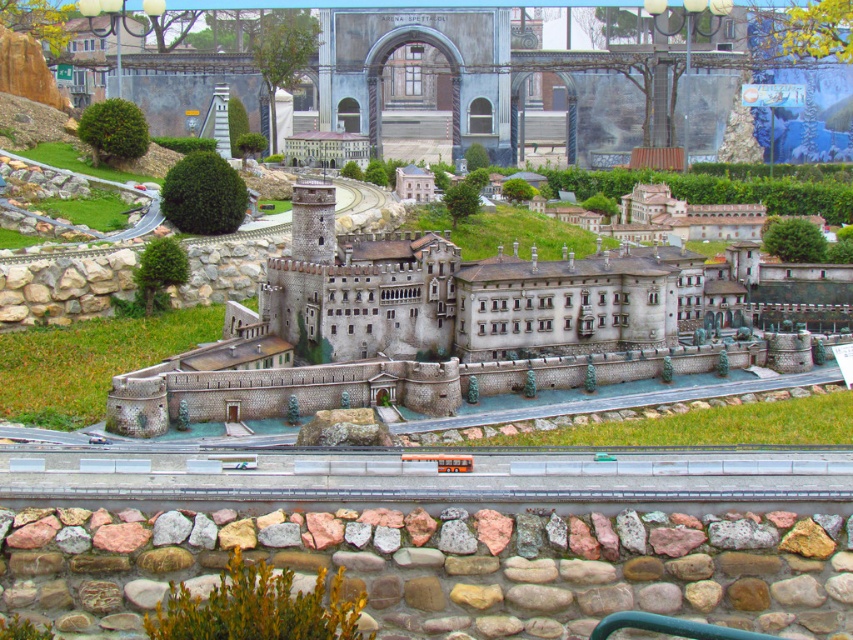
Question: Does stone castle at center lie behind smooth gray train track at center?

Choices:
 (A) no
 (B) yes

Answer: (B)

Question: Is stone castle at center positioned in front of smooth gray train track at center?

Choices:
 (A) no
 (B) yes

Answer: (A)

Question: Considering the relative positions of stone castle at center and smooth gray train track at center in the image provided, where is stone castle at center located with respect to smooth gray train track at center?

Choices:
 (A) right
 (B) left

Answer: (B)

Question: Among these points, which one is farthest from the camera?

Choices:
 (A) (368, 364)
 (B) (666, 502)

Answer: (A)

Question: Which of the following is the closest to the observer?

Choices:
 (A) stone castle at center
 (B) smooth gray train track at center

Answer: (B)